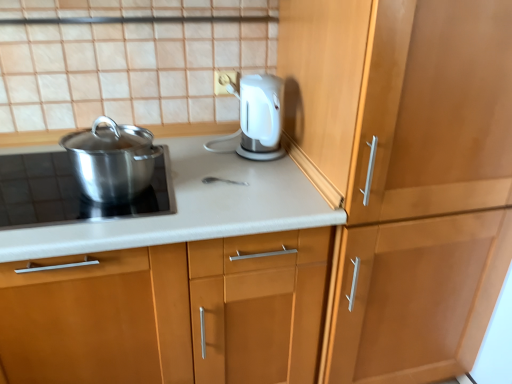
I want to click on matte white countertop at center, the second cabinetry when ordered from right to left, so click(x=169, y=313).

Measure the distance between polished stainless steel pot at left and camera.

polished stainless steel pot at left and camera are 1.06 meters apart from each other.

At what (x,y) coordinates should I click in order to perform the action: click on wooden cabinet at right, marked as the second cabinetry in a left-to-right arrangement. Please return your answer as a coordinate pair (x, y). The height and width of the screenshot is (384, 512). Looking at the image, I should click on (408, 173).

This screenshot has width=512, height=384. Identify the location of polished stainless steel pot at left. (70, 192).

Is wooden cabinet at right, the 1th cabinetry viewed from the right, placed right next to matte white countertop at center, the second cabinetry when ordered from right to left?

No, wooden cabinet at right, the 1th cabinetry viewed from the right, is not touching matte white countertop at center, the second cabinetry when ordered from right to left.

Does wooden cabinet at right, the 1th cabinetry viewed from the right, have a lesser width compared to matte white countertop at center, the second cabinetry when ordered from right to left?

No.

Looking at this image, considering the relative positions of wooden cabinet at right, the 1th cabinetry viewed from the right, and matte white countertop at center, arranged as the 1th cabinetry when viewed from the left, in the image provided, is wooden cabinet at right, the 1th cabinetry viewed from the right, to the right of matte white countertop at center, arranged as the 1th cabinetry when viewed from the left, from the viewer's perspective?

Yes, wooden cabinet at right, the 1th cabinetry viewed from the right, is to the right of matte white countertop at center, arranged as the 1th cabinetry when viewed from the left.

Considering the positions of objects polished stainless steel pot at left and matte white countertop at center, the second cabinetry when ordered from right to left, in the image provided, who is more to the right, polished stainless steel pot at left or matte white countertop at center, the second cabinetry when ordered from right to left,?

matte white countertop at center, the second cabinetry when ordered from right to left.

Who is taller, polished stainless steel pot at left or matte white countertop at center, arranged as the 1th cabinetry when viewed from the left?

Standing taller between the two is matte white countertop at center, arranged as the 1th cabinetry when viewed from the left.

From a real-world perspective, which is physically below, polished stainless steel pot at left or matte white countertop at center, the second cabinetry when ordered from right to left?

matte white countertop at center, the second cabinetry when ordered from right to left, from a real-world perspective.

Based on their sizes in the image, would you say polished stainless steel pot at left is bigger or smaller than matte white countertop at center, arranged as the 1th cabinetry when viewed from the left?

Clearly, polished stainless steel pot at left is smaller in size than matte white countertop at center, arranged as the 1th cabinetry when viewed from the left.

Consider the image. From the image's perspective, is polished stainless steel pot at left under wooden cabinet at right, marked as the second cabinetry in a left-to-right arrangement?

Actually, polished stainless steel pot at left appears above wooden cabinet at right, marked as the second cabinetry in a left-to-right arrangement, in the image.

Does point (119, 147) come farther from viewer compared to point (432, 133)?

No, (119, 147) is closer to viewer.

Which is in front, polished stainless steel pot at left or wooden cabinet at right, marked as the second cabinetry in a left-to-right arrangement?

wooden cabinet at right, marked as the second cabinetry in a left-to-right arrangement, is in front.

Consider the image. From a real-world perspective, is polished stainless steel pot at left over polished stainless steel pot at left?

Yes, from a real-world perspective, polished stainless steel pot at left is over polished stainless steel pot at left

Could you tell me if polished stainless steel pot at left is turned towards polished stainless steel pot at left?

No, polished stainless steel pot at left is not oriented towards polished stainless steel pot at left.

Would you say polished stainless steel pot at left is outside polished stainless steel pot at left?

That's correct, polished stainless steel pot at left is outside of polished stainless steel pot at left.

Considering the relative positions of polished stainless steel pot at left and polished stainless steel pot at left in the image provided, is polished stainless steel pot at left to the right of polished stainless steel pot at left from the viewer's perspective?

Yes.

Choose the correct answer: Is polished stainless steel pot at left inside matte white countertop at center, the second cabinetry when ordered from right to left, or outside it?

polished stainless steel pot at left exists outside the volume of matte white countertop at center, the second cabinetry when ordered from right to left.

Is point (118, 201) closer or farther from the camera than point (126, 331)?

Point (118, 201) is positioned closer to the camera compared to point (126, 331).

Consider the image. From the image's perspective, is polished stainless steel pot at left below matte white countertop at center, the second cabinetry when ordered from right to left?

Actually, polished stainless steel pot at left appears above matte white countertop at center, the second cabinetry when ordered from right to left, in the image.

Which of these two, polished stainless steel pot at left or wooden cabinet at right, marked as the second cabinetry in a left-to-right arrangement, is bigger?

With larger size is wooden cabinet at right, marked as the second cabinetry in a left-to-right arrangement.

Does polished stainless steel pot at left contain wooden cabinet at right, marked as the second cabinetry in a left-to-right arrangement?

Definitely not — wooden cabinet at right, marked as the second cabinetry in a left-to-right arrangement, is not inside polished stainless steel pot at left.

I want to click on cabinetry that is the 2nd object to the right of the polished stainless steel pot at left, starting at the anchor, so click(408, 173).

Is polished stainless steel pot at left oriented towards wooden cabinet at right, the 1th cabinetry viewed from the right?

No, polished stainless steel pot at left is not oriented towards wooden cabinet at right, the 1th cabinetry viewed from the right.

Is matte white countertop at center, arranged as the 1th cabinetry when viewed from the left, in front of or behind polished stainless steel pot at left in the image?

matte white countertop at center, arranged as the 1th cabinetry when viewed from the left, is in front of polished stainless steel pot at left.

Is matte white countertop at center, arranged as the 1th cabinetry when viewed from the left, not inside polished stainless steel pot at left?

Yes, matte white countertop at center, arranged as the 1th cabinetry when viewed from the left, is outside of polished stainless steel pot at left.

From the image's perspective, which one is positioned higher, matte white countertop at center, the second cabinetry when ordered from right to left, or polished stainless steel pot at left?

polished stainless steel pot at left, from the image's perspective.

Can you confirm if matte white countertop at center, the second cabinetry when ordered from right to left, is taller than polished stainless steel pot at left?

Correct, matte white countertop at center, the second cabinetry when ordered from right to left, is much taller as polished stainless steel pot at left.

Locate an element on the screen. Image resolution: width=512 pixels, height=384 pixels. cabinetry on the left side of wooden cabinet at right, the 1th cabinetry viewed from the right is located at coordinates (169, 313).

Identify the location of cabinetry that is the 1st one when counting forward from the polished stainless steel pot at left. Image resolution: width=512 pixels, height=384 pixels. (169, 313).

When comparing their distances from matte white countertop at center, arranged as the 1th cabinetry when viewed from the left, does wooden cabinet at right, marked as the second cabinetry in a left-to-right arrangement, or polished stainless steel pot at left seem further?

wooden cabinet at right, marked as the second cabinetry in a left-to-right arrangement, is further to matte white countertop at center, arranged as the 1th cabinetry when viewed from the left.

Looking at this image, when comparing their distances from polished stainless steel pot at left, does matte white countertop at center, arranged as the 1th cabinetry when viewed from the left, or wooden cabinet at right, the 1th cabinetry viewed from the right, seem closer?

Based on the image, matte white countertop at center, arranged as the 1th cabinetry when viewed from the left, appears to be nearer to polished stainless steel pot at left.

Based on their spatial positions, is wooden cabinet at right, marked as the second cabinetry in a left-to-right arrangement, or polished stainless steel pot at left closer to matte white countertop at center, arranged as the 1th cabinetry when viewed from the left?

Among the two, polished stainless steel pot at left is located nearer to matte white countertop at center, arranged as the 1th cabinetry when viewed from the left.

From the image, which object appears to be nearer to matte white countertop at center, arranged as the 1th cabinetry when viewed from the left, polished stainless steel pot at left or polished stainless steel pot at left?

polished stainless steel pot at left.

Estimate the real-world distances between objects in this image. Which object is further from polished stainless steel pot at left, wooden cabinet at right, the 1th cabinetry viewed from the right, or polished stainless steel pot at left?

The object further to polished stainless steel pot at left is wooden cabinet at right, the 1th cabinetry viewed from the right.

Based on their spatial positions, is polished stainless steel pot at left or polished stainless steel pot at left further from wooden cabinet at right, the 1th cabinetry viewed from the right?

Among the two, polished stainless steel pot at left is located further to wooden cabinet at right, the 1th cabinetry viewed from the right.

Based on the photo, estimate the real-world distances between objects in this image. Which object is further from polished stainless steel pot at left, matte white countertop at center, arranged as the 1th cabinetry when viewed from the left, or polished stainless steel pot at left?

matte white countertop at center, arranged as the 1th cabinetry when viewed from the left.

Looking at the image, which one is located closer to matte white countertop at center, the second cabinetry when ordered from right to left, polished stainless steel pot at left or wooden cabinet at right, the 1th cabinetry viewed from the right?

Among the two, polished stainless steel pot at left is located nearer to matte white countertop at center, the second cabinetry when ordered from right to left.

At what (x,y) coordinates should I click in order to perform the action: click on home appliance between polished stainless steel pot at left and matte white countertop at center, arranged as the 1th cabinetry when viewed from the left, from top to bottom. Please return your answer as a coordinate pair (x, y). This screenshot has height=384, width=512. Looking at the image, I should click on (70, 192).

Locate an element on the screen. cabinetry between polished stainless steel pot at left and wooden cabinet at right, the 1th cabinetry viewed from the right, from left to right is located at coordinates (169, 313).

Identify the location of kitchen appliance located between polished stainless steel pot at left and wooden cabinet at right, marked as the second cabinetry in a left-to-right arrangement, in the left-right direction. (112, 160).

Where is `kitchen appliance between matte white countertop at center, the second cabinetry when ordered from right to left, and wooden cabinet at right, the 1th cabinetry viewed from the right, from left to right`? kitchen appliance between matte white countertop at center, the second cabinetry when ordered from right to left, and wooden cabinet at right, the 1th cabinetry viewed from the right, from left to right is located at coordinates 112,160.